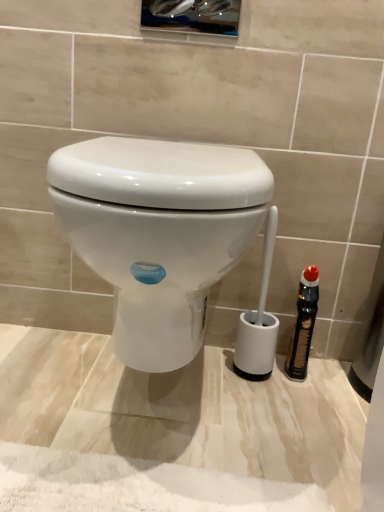
I want to click on white glossy toilet at center, so click(162, 233).

This screenshot has height=512, width=384. What do you see at coordinates (162, 233) in the screenshot?
I see `white glossy toilet at center` at bounding box center [162, 233].

You are a GUI agent. You are given a task and a screenshot of the screen. Output one action in this format:
    pyautogui.click(x=<x>, y=<y>)
    Task: Click on the black plastic bottle at right
    This screenshot has width=384, height=512.
    Given the screenshot: What is the action you would take?
    pyautogui.click(x=303, y=325)

Describe the element at coordinates (303, 325) in the screenshot. I see `black plastic bottle at right` at that location.

Where is `white glossy toilet at center`? This screenshot has height=512, width=384. white glossy toilet at center is located at coordinates (162, 233).

Which object is positioned more to the right, black plastic bottle at right or white glossy toilet at center?

Positioned to the right is black plastic bottle at right.

From the picture: Which is behind, black plastic bottle at right or white glossy toilet at center?

black plastic bottle at right.

Does point (304, 275) come in front of point (263, 309)?

Yes.

From the image's perspective, between black plastic bottle at right and white glossy toilet at center, who is located below?

black plastic bottle at right is shown below in the image.

From a real-world perspective, which object rests below the other?

From a 3D spatial view, black plastic bottle at right is below.

Considering the sizes of objects black plastic bottle at right and white glossy toilet at center in the image provided, who is wider, black plastic bottle at right or white glossy toilet at center?

white glossy toilet at center.

Is black plastic bottle at right taller or shorter than white glossy toilet at center?

black plastic bottle at right is shorter than white glossy toilet at center.

Considering the sizes of objects black plastic bottle at right and white glossy toilet at center in the image provided, who is bigger, black plastic bottle at right or white glossy toilet at center?

Bigger between the two is white glossy toilet at center.

Consider the image. Is black plastic bottle at right outside of white glossy toilet at center?

Yes, black plastic bottle at right is located beyond the bounds of white glossy toilet at center.

Is black plastic bottle at right positioned far away from white glossy toilet at center?

No, black plastic bottle at right is not far away from white glossy toilet at center.

Could you tell me if black plastic bottle at right is turned towards white glossy toilet at center?

No, black plastic bottle at right is not oriented towards white glossy toilet at center.

You are a GUI agent. You are given a task and a screenshot of the screen. Output one action in this format:
    pyautogui.click(x=<x>, y=<y>)
    Task: Click on the toilet in front of the black plastic bottle at right
    This screenshot has height=512, width=384.
    Given the screenshot: What is the action you would take?
    pyautogui.click(x=162, y=233)

Considering the positions of objects white glossy toilet at center and black plastic bottle at right in the image provided, who is more to the left, white glossy toilet at center or black plastic bottle at right?

Positioned to the left is white glossy toilet at center.

Is white glossy toilet at center positioned behind black plastic bottle at right?

That is False.

Does point (64, 198) come in front of point (306, 348)?

Yes, point (64, 198) is closer to viewer.

From the image's perspective, which is below, white glossy toilet at center or black plastic bottle at right?

black plastic bottle at right appears lower in the image.

From a real-world perspective, which object rests below the other?

black plastic bottle at right, from a real-world perspective.

Is white glossy toilet at center wider than black plastic bottle at right?

Yes.

Considering the relative sizes of white glossy toilet at center and black plastic bottle at right in the image provided, is white glossy toilet at center shorter than black plastic bottle at right?

In fact, white glossy toilet at center may be taller than black plastic bottle at right.

Can you confirm if white glossy toilet at center is smaller than black plastic bottle at right?

Actually, white glossy toilet at center might be larger than black plastic bottle at right.

Is white glossy toilet at center positioned beyond the bounds of black plastic bottle at right?

Yes, white glossy toilet at center is located beyond the bounds of black plastic bottle at right.

Is white glossy toilet at center far away from black plastic bottle at right?

That's not correct — white glossy toilet at center is a little close to black plastic bottle at right.

From the picture: Is white glossy toilet at center turned away from black plastic bottle at right?

white glossy toilet at center is not turned away from black plastic bottle at right.

What's the angular difference between white glossy toilet at center and black plastic bottle at right's facing directions?

The angle between the facing direction of white glossy toilet at center and the facing direction of black plastic bottle at right is 8.51 degrees.

Locate an element on the screen. The width and height of the screenshot is (384, 512). toilet in front of the black plastic bottle at right is located at coordinates (162, 233).

This screenshot has width=384, height=512. Identify the location of toilet positioned vertically above the black plastic bottle at right (from a real-world perspective). (162, 233).

This screenshot has width=384, height=512. Find the location of `toilet in front of the black plastic bottle at right`. toilet in front of the black plastic bottle at right is located at coordinates (162, 233).